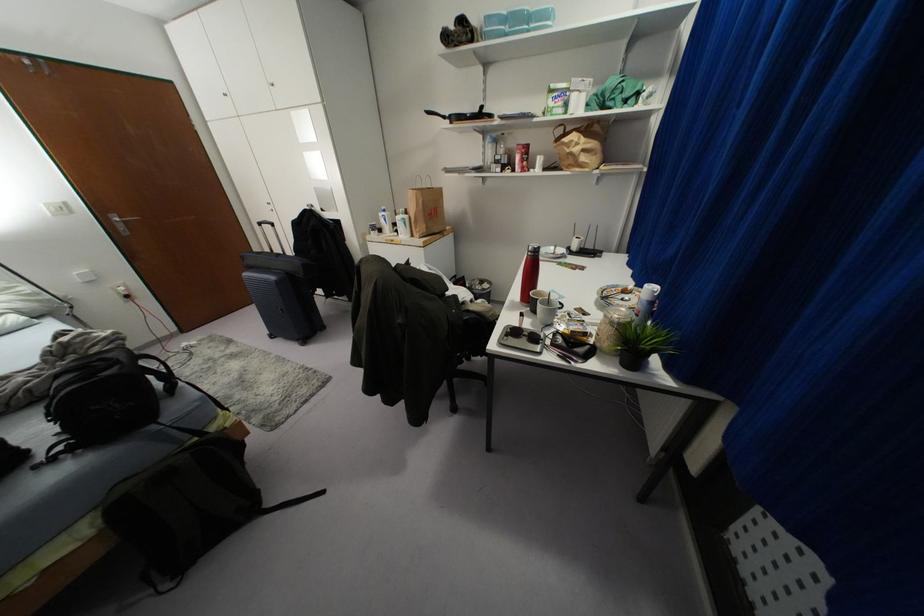
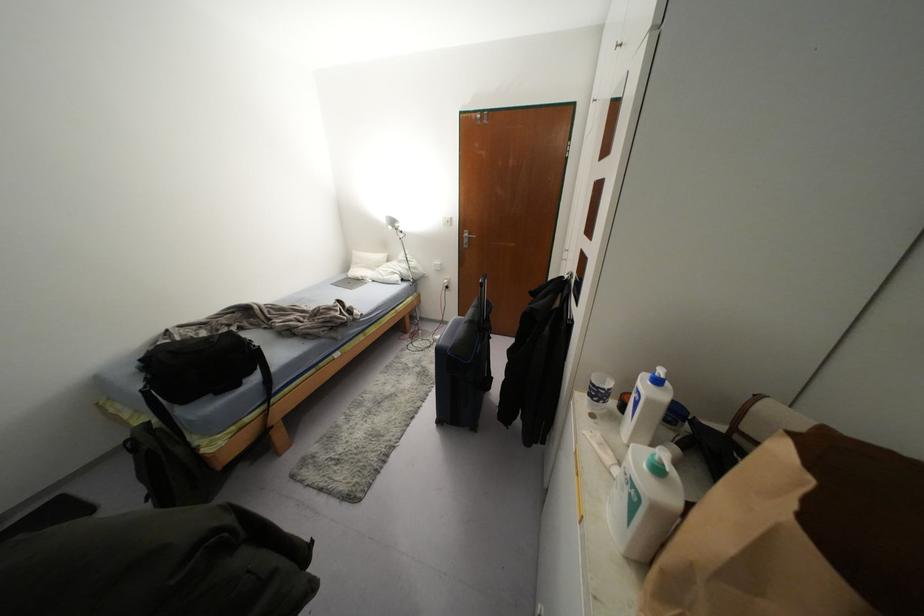
Locate, in the second image, the point that corresponds to (x=404, y=223) in the first image.

(633, 505)